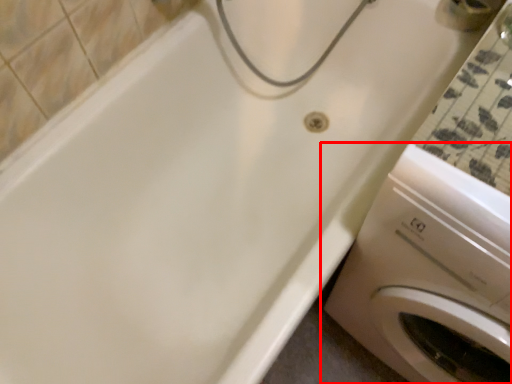
Question: From the image's perspective, where is washing machine (annotated by the red box) located in relation to faucet in the image?

Choices:
 (A) above
 (B) below

Answer: (B)